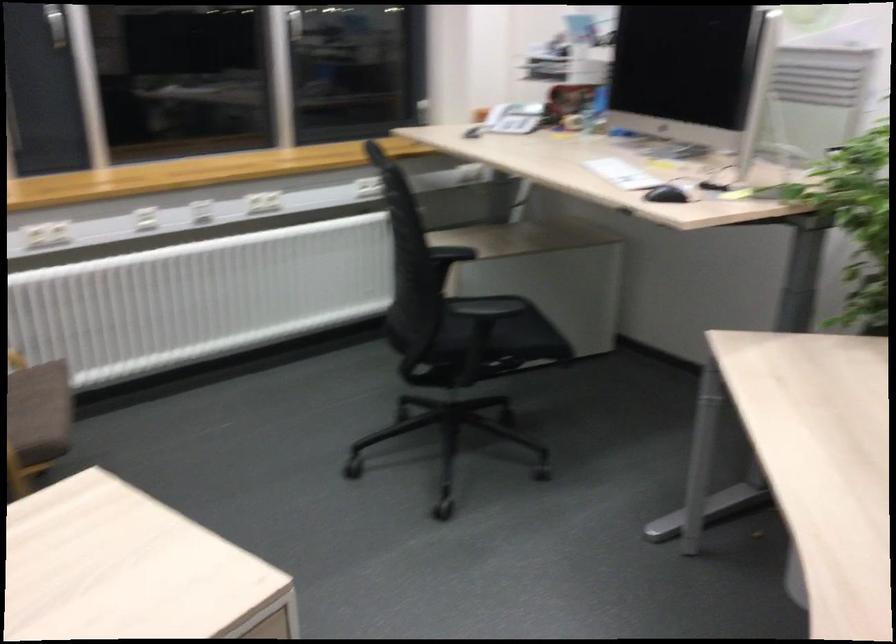
The height and width of the screenshot is (644, 896). I want to click on black chair sitting surface, so click(x=513, y=326).